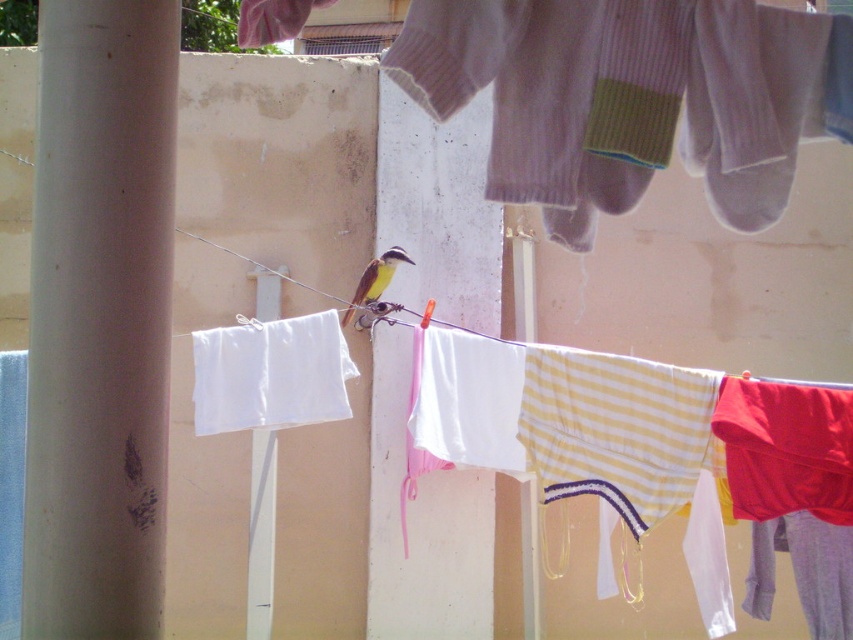
Question: Which object is closer to the camera taking this photo?

Choices:
 (A) white fabric at center
 (B) ribbed wool socks at upper center
 (C) brown feathered bird at center
 (D) white smooth pole at left

Answer: (B)

Question: Is white fabric at center further to camera compared to brown feathered bird at center?

Choices:
 (A) yes
 (B) no

Answer: (B)

Question: Among these objects, which one is nearest to the camera?

Choices:
 (A) ribbed wool socks at upper center
 (B) white fabric at center
 (C) white smooth pole at center

Answer: (A)

Question: Which point is farther from the camera taking this photo?

Choices:
 (A) (167, 152)
 (B) (262, 618)
 (C) (805, 28)
 (D) (210, 392)

Answer: (B)

Question: Can you confirm if white fabric at center is thinner than brown feathered bird at center?

Choices:
 (A) yes
 (B) no

Answer: (B)

Question: Is ribbed wool socks at upper center behind white fabric at center?

Choices:
 (A) yes
 (B) no

Answer: (B)